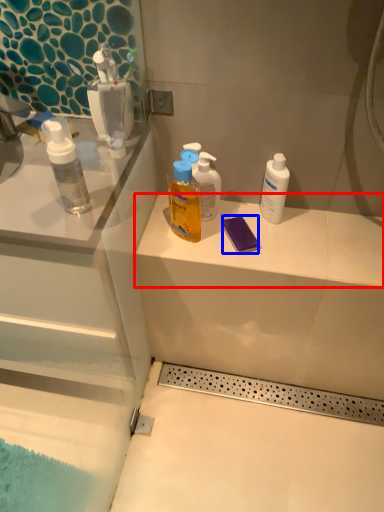
Question: Which point is further to the camera, counter top (highlighted by a red box) or soap (highlighted by a blue box)?

Choices:
 (A) counter top
 (B) soap

Answer: (B)